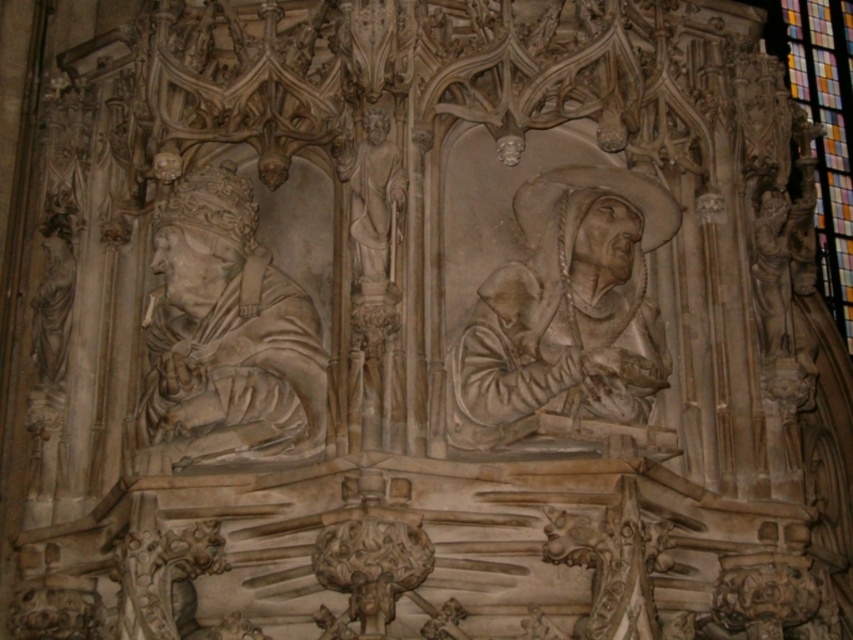
Is stained glass at upper right bigger than white marble statue at center?

Yes.

Can you confirm if stained glass at upper right is smaller than white marble statue at center?

No.

Where is `stained glass at upper right`? This screenshot has width=853, height=640. stained glass at upper right is located at coordinates click(x=827, y=134).

Where is `stained glass at upper right`? stained glass at upper right is located at coordinates (827, 134).

Is point (140, 429) more distant than point (376, 147)?

Yes, it is.

Does white marble statue at left have a greater width compared to white marble statue at center?

Indeed, white marble statue at left has a greater width compared to white marble statue at center.

Find the location of `white marble statue at left`. white marble statue at left is located at coordinates (225, 339).

Does point (473, 416) come in front of point (366, 147)?

Yes, it is.

Who is positioned more to the left, gray stone statue at center or white marble statue at center?

white marble statue at center

Between point (567, 225) and point (335, 148), which one is positioned in front?

Point (567, 225) is more forward.

This screenshot has width=853, height=640. Identify the location of gray stone statue at center. coord(567,317).